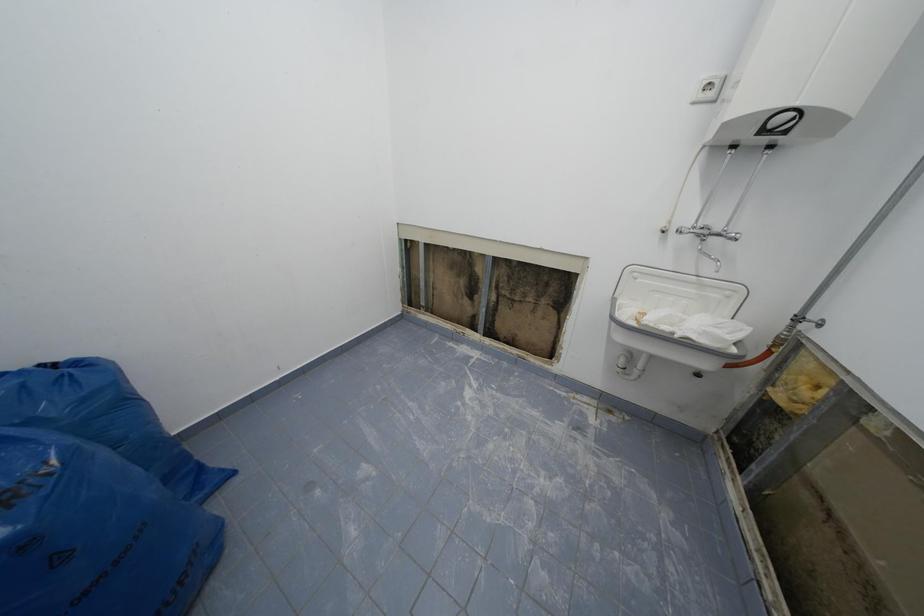
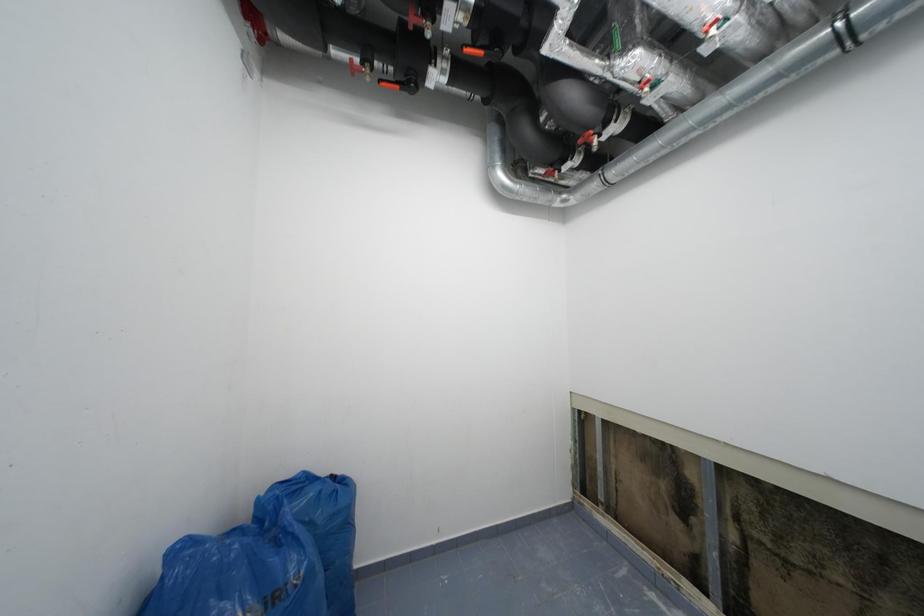
The first image is from the beginning of the video and the second image is from the end. How did the camera likely rotate when shooting the video?

The camera rotated toward left-up.